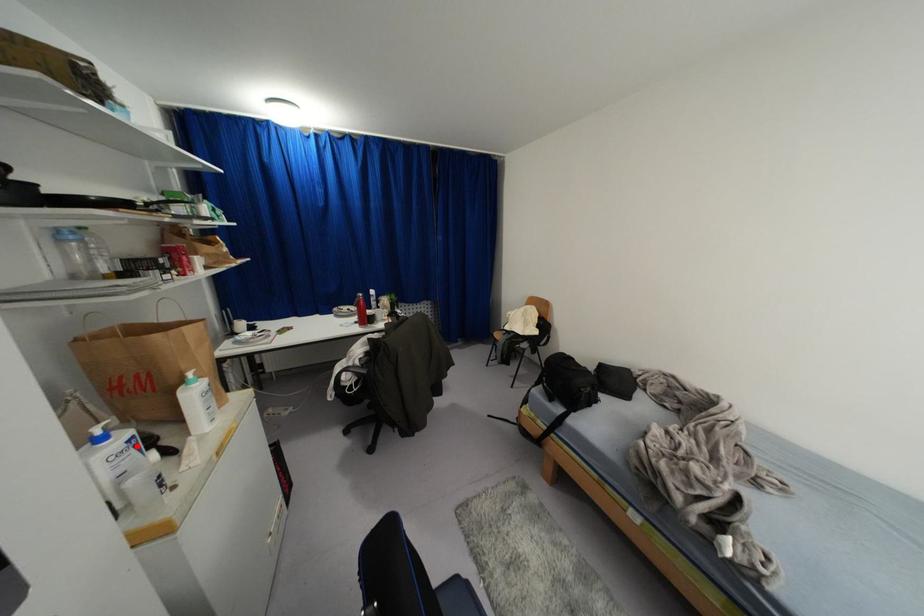
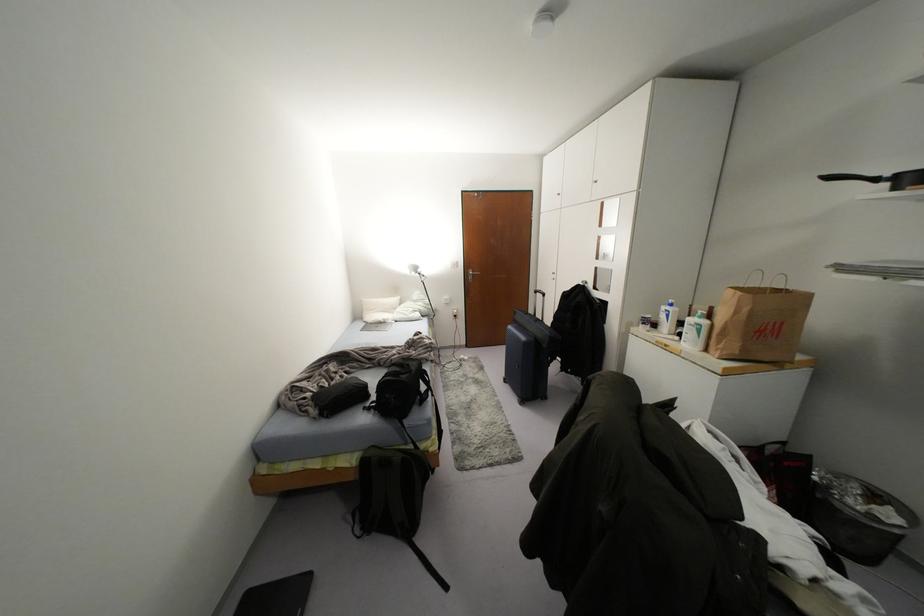
Locate, in the second image, the point that corresponds to the highlighted location in the first image.

(666, 315)